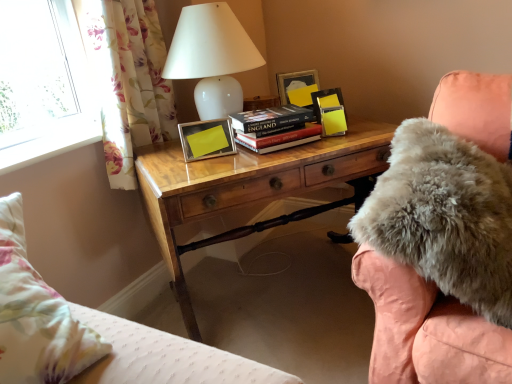
Identify the location of vacant space in front of metallic silver picture frame at center, which is the 1th picture frame in bottom-to-top order. (218, 170).